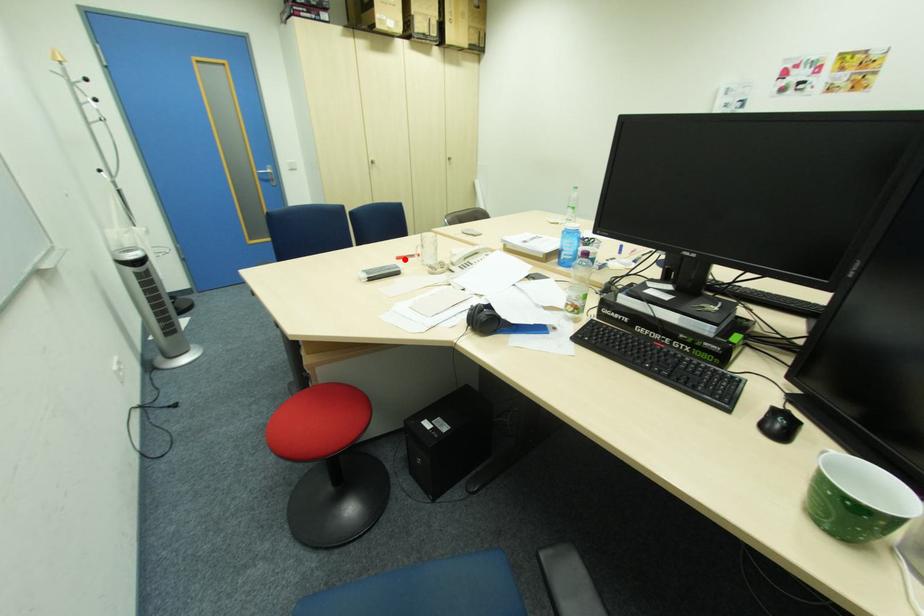
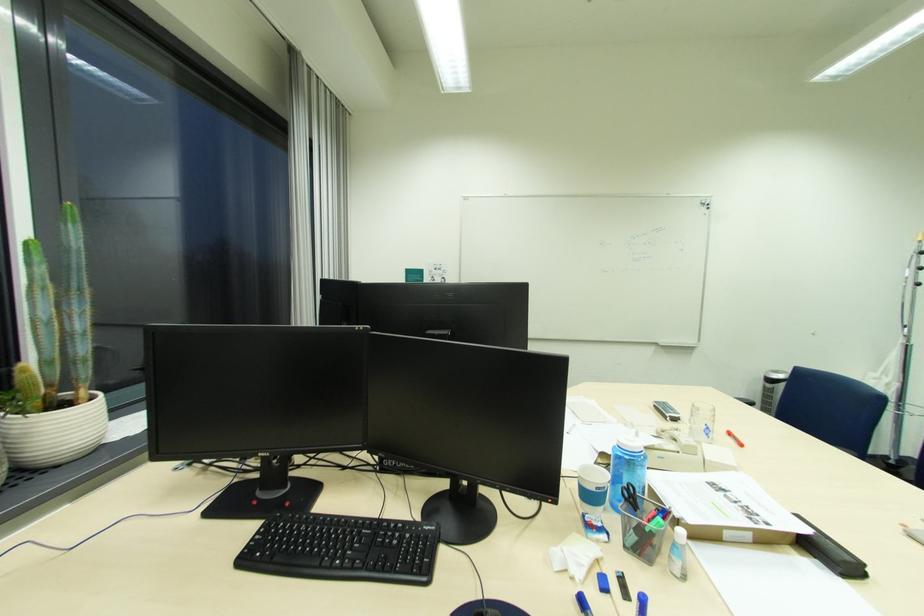
Question: I am providing you with two images of the same scene from different viewpoints. A red point is marked on the first image. Can you still see the location of the red point in image 2?

Choices:
 (A) Yes
 (B) No

Answer: (A)